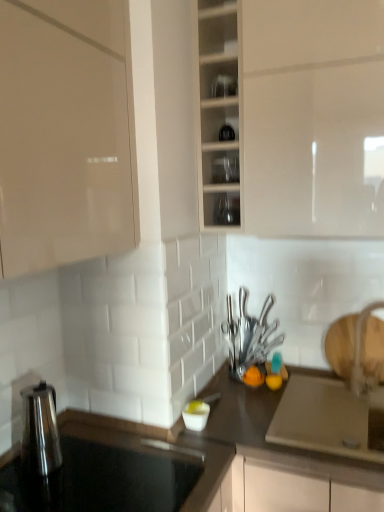
Question: Relative to polished silver knife set at center, placed as the 2th tableware when sorted from top to bottom, is white glossy faucet at right in front or behind?

Choices:
 (A) front
 (B) behind

Answer: (A)

Question: From a real-world perspective, is white glossy faucet at right above or below polished silver knife set at center, the third tableware positioned from the front?

Choices:
 (A) below
 (B) above

Answer: (A)

Question: Estimate the real-world distances between objects in this image. Which object is closer to the transparent glass cabinet at center?

Choices:
 (A) clear glass cups at center, arranged as the second tableware when viewed from the back
 (B) white glossy faucet at right
 (C) polished silver knife set at center, the 2th tableware from the bottom
 (D) white glossy bowl at center, the 3th tableware positioned from the top
 (E) dark gray laminate countertop at center, which is counted as the first countertop, starting from the bottom

Answer: (A)

Question: Considering the real-world distances, which object is closest to the white glossy faucet at right?

Choices:
 (A) dark gray laminate countertop at center, which is the second countertop from top to bottom
 (B) clear glassware at center, acting as the first shelf starting from the bottom
 (C) transparent glass jars at upper center, marked as the first shelf in a top-to-bottom arrangement
 (D) polished silver knife set at center, placed as the 2th tableware when sorted from top to bottom
 (E) white glossy bowl at center, acting as the first tableware starting from the left

Answer: (D)